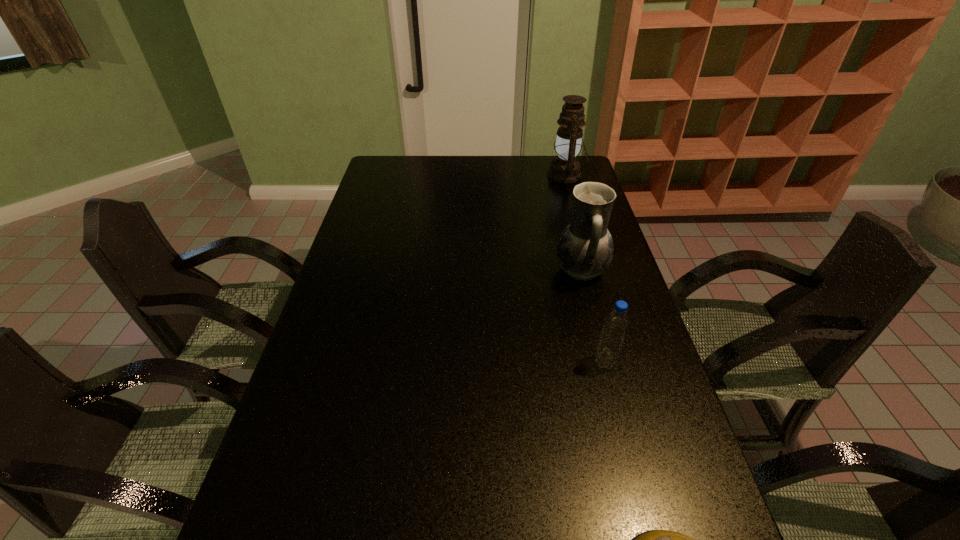
Image resolution: width=960 pixels, height=540 pixels. Find the location of `object that is at the far edge`. object that is at the far edge is located at coordinates (564, 169).

Identify the location of oil lamp present at the right edge. (564, 169).

You are a GUI agent. You are given a task and a screenshot of the screen. Output one action in this format:
    pyautogui.click(x=<x>, y=<y>)
    Task: Click on the pitcher located in the right edge section of the desktop
    
    Given the screenshot: What is the action you would take?
    pyautogui.click(x=585, y=248)

I want to click on water bottle situated at the right edge, so click(615, 326).

I want to click on object positioned at the far right corner, so click(564, 169).

In the image, there is a desktop. Where is `vacant space at the far edge`? Image resolution: width=960 pixels, height=540 pixels. vacant space at the far edge is located at coordinates (442, 163).

This screenshot has width=960, height=540. I want to click on free point at the left edge, so click(x=315, y=369).

Locate an element on the screen. This screenshot has width=960, height=540. free space at the right edge is located at coordinates tap(589, 336).

The width and height of the screenshot is (960, 540). Find the location of `vacant space at the far left corner of the desktop`. vacant space at the far left corner of the desktop is located at coordinates (372, 181).

This screenshot has height=540, width=960. Find the location of `object that stands as the second closest to the oil lamp`. object that stands as the second closest to the oil lamp is located at coordinates (615, 326).